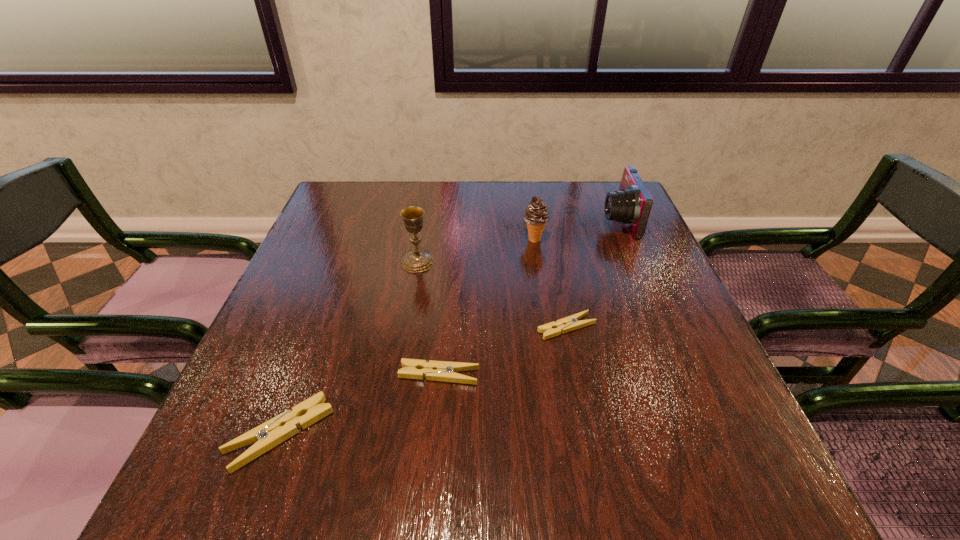
Image resolution: width=960 pixels, height=540 pixels. In order to click on object at the right edge in this screenshot , I will do `click(631, 205)`.

Locate an element on the screen. This screenshot has height=540, width=960. object that is at the near left corner is located at coordinates (268, 435).

In order to click on object that is at the far right corner in this screenshot , I will do `click(631, 205)`.

Where is `vacant space at the far edge of the desktop`? This screenshot has width=960, height=540. vacant space at the far edge of the desktop is located at coordinates (402, 186).

You are a GUI agent. You are given a task and a screenshot of the screen. Output one action in this format:
    pyautogui.click(x=<x>, y=<y>)
    Task: Click on the free space at the near edge of the desktop
    The height and width of the screenshot is (540, 960).
    Given the screenshot: What is the action you would take?
    pyautogui.click(x=468, y=413)

Find the location of a particular element. vacant region at the left edge of the desktop is located at coordinates (306, 346).

In the image, there is a desktop. Where is `vacant space at the right edge`? The width and height of the screenshot is (960, 540). vacant space at the right edge is located at coordinates (x=636, y=285).

At what (x,y) coordinates should I click in order to perform the action: click on vacant space at the far left corner of the desktop. Please return your answer as a coordinate pair (x, y). Looking at the image, I should click on (333, 224).

Identify the location of vacant area at the near left corner of the desktop. (257, 397).

Identify the location of free space at the far right corner of the desktop. The height and width of the screenshot is (540, 960). (598, 194).